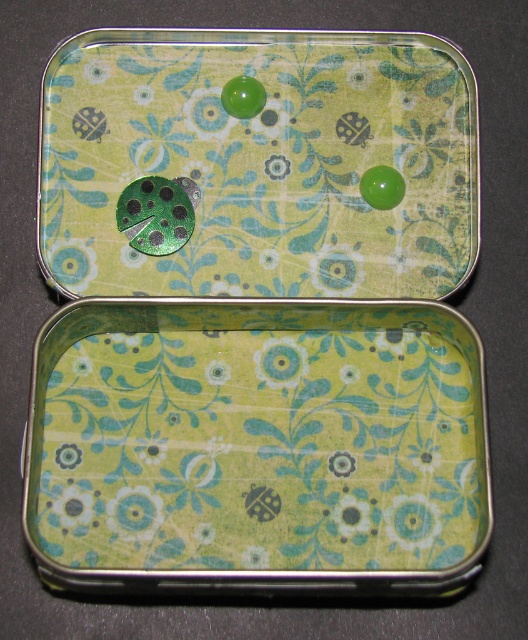
Can you confirm if green floral-patterned tray at center is smaller than green matte ladybug at upper center?

No.

Between green floral-patterned tray at center and green matte ladybug at upper center, which one appears on the right side from the viewer's perspective?

green matte ladybug at upper center is more to the right.

Is point (429, 529) positioned behind point (257, 92)?

That is False.

Find the location of `green floral-patterned tray at center`. green floral-patterned tray at center is located at coordinates (258, 448).